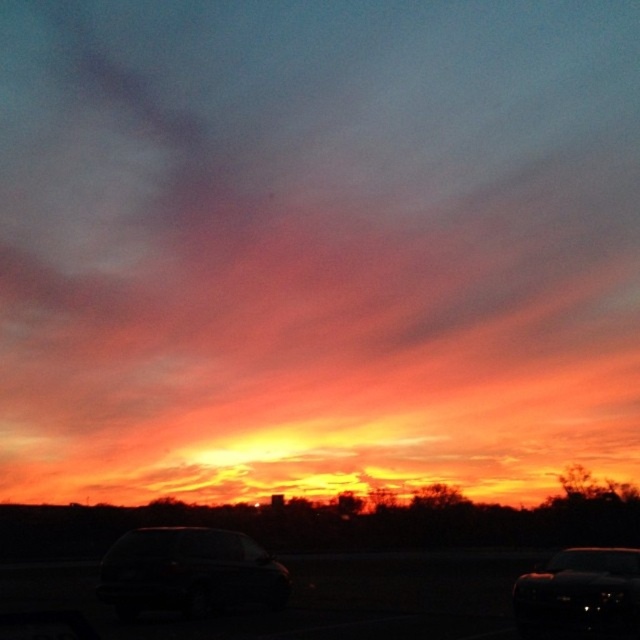
Question: Which is farther from the shiny black car at center?

Choices:
 (A) transparent glass car window at lower center
 (B) glossy black car at lower right

Answer: (B)

Question: In this image, where is shiny black car at center located relative to transparent glass car window at lower right?

Choices:
 (A) above
 (B) below

Answer: (A)

Question: Does shiny black car at center appear under transparent glass car window at lower right?

Choices:
 (A) yes
 (B) no

Answer: (B)

Question: Does transparent glass car window at lower right appear on the right side of transparent glass car window at lower center?

Choices:
 (A) no
 (B) yes

Answer: (B)

Question: Estimate the real-world distances between objects in this image. Which object is closer to the glossy black car at lower right?

Choices:
 (A) transparent glass car window at lower center
 (B) transparent glass car window at lower right

Answer: (B)

Question: Which point is farther from the camera taking this photo?

Choices:
 (A) (541, 625)
 (B) (195, 561)
 (C) (637, 570)

Answer: (B)